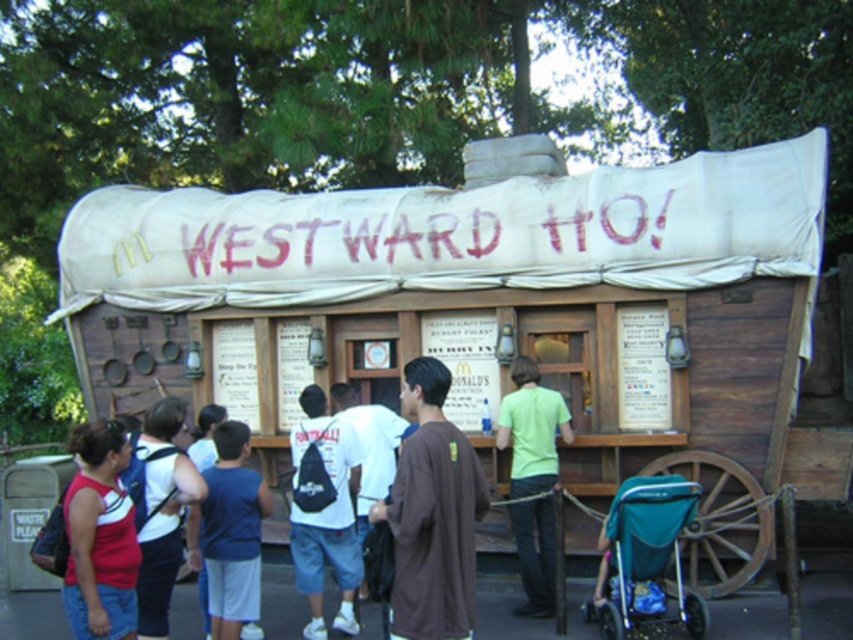
You are a visitor at the attraction and want to know if you can easily see the teal fabric stroller at lower right from where the matte red tank top at lower left is located. Can you see it clearly?

The matte red tank top at lower left is closer to the viewer than the teal fabric stroller at lower right. Since the matte red tank top is in front, it might block the view of the teal fabric stroller at lower right depending on their positions.